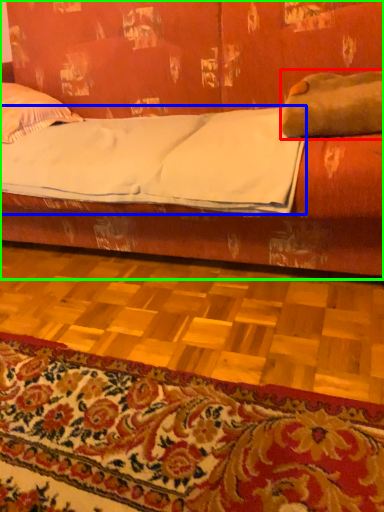
Question: Estimate the real-world distances between objects in this image. Which object is farther from pillow (highlighted by a red box), sheet (highlighted by a blue box) or studio couch (highlighted by a green box)?

Choices:
 (A) sheet
 (B) studio couch

Answer: (B)